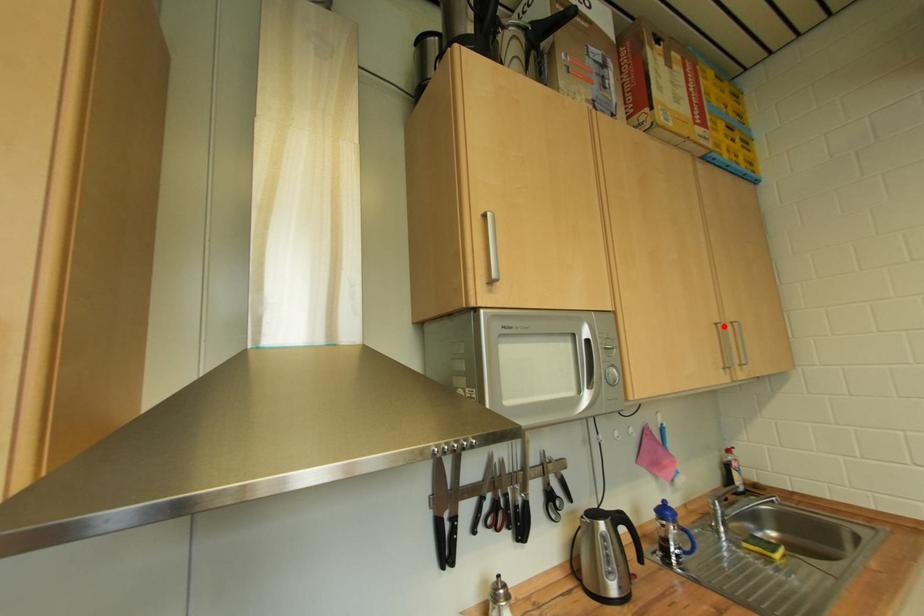
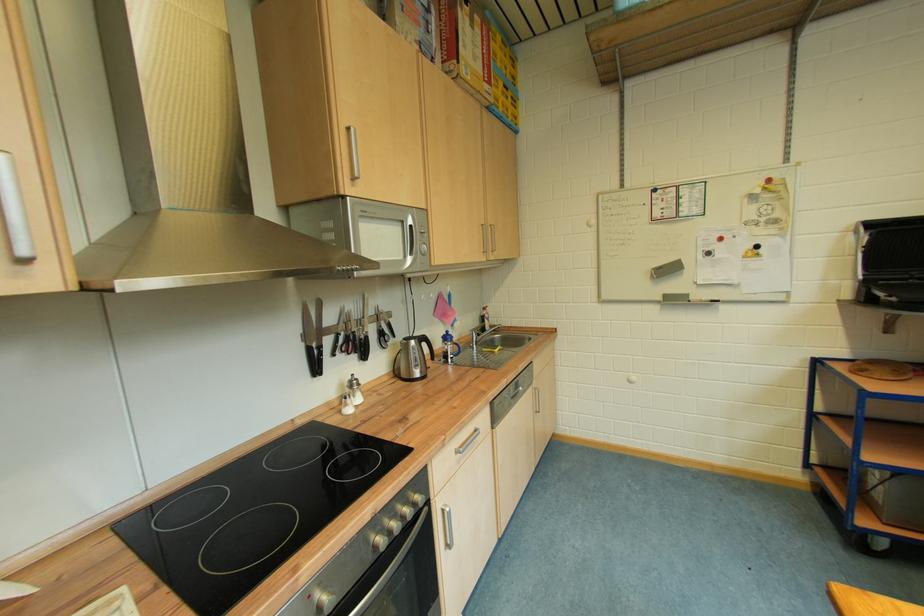
Find the pixel in the second image that matches the highlighted location in the first image.

(490, 228)